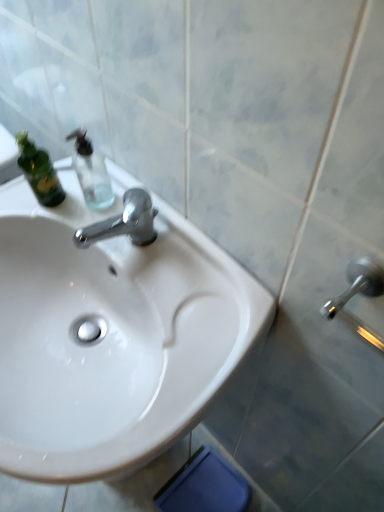
You are a GUI agent. You are given a task and a screenshot of the screen. Output one action in this format:
    pyautogui.click(x=<x>, y=<y>)
    Task: Click on the free space in front of transparent glass soap dispenser at upper left
    The height and width of the screenshot is (512, 384).
    Given the screenshot: What is the action you would take?
    pyautogui.click(x=134, y=264)